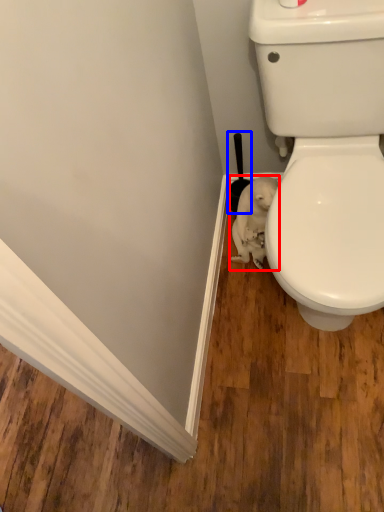
Question: Which object appears closest to the camera in this image, animal (highlighted by a red box) or brush (highlighted by a blue box)?

Choices:
 (A) animal
 (B) brush

Answer: (A)